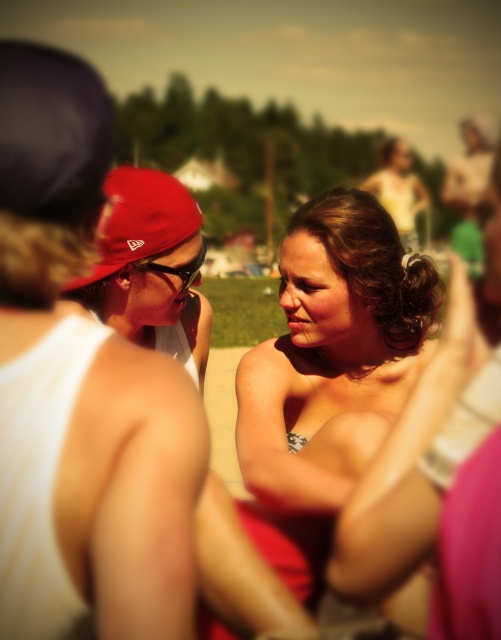
Which is in front, point (384, 294) or point (80, 280)?

Point (80, 280) is more forward.

How far apart are shiny gold necklace at center and matte red cap at center?

15.31 inches

You are a GUI agent. You are given a task and a screenshot of the screen. Output one action in this format:
    pyautogui.click(x=<x>, y=<y>)
    Task: Click on the shiny gold necklace at center
    The image size is (501, 640).
    Given the screenshot: What is the action you would take?
    pyautogui.click(x=327, y=369)

Find the location of `shiny gold necklace at center`. shiny gold necklace at center is located at coordinates (327, 369).

Is point (287, 444) closer to viewer compared to point (126, 259)?

Yes, it is.

Does point (284, 580) lie behind point (150, 224)?

No, it is not.

You are a GUI agent. You are given a task and a screenshot of the screen. Output one action in this format:
    pyautogui.click(x=<x>, y=<y>)
    Task: Click on the shiny gold necklace at center
    This screenshot has width=501, height=640.
    Given the screenshot: What is the action you would take?
    pyautogui.click(x=327, y=369)

Which is more to the left, shiny gold necklace at center or matte brown hair at center?

From the viewer's perspective, shiny gold necklace at center appears more on the left side.

Is shiny gold necklace at center smaller than matte brown hair at center?

Yes.

Does point (313, 564) come behind point (367, 186)?

That is False.

Image resolution: width=501 pixels, height=640 pixels. What are the coordinates of `shiny gold necklace at center` in the screenshot? It's located at (327, 369).